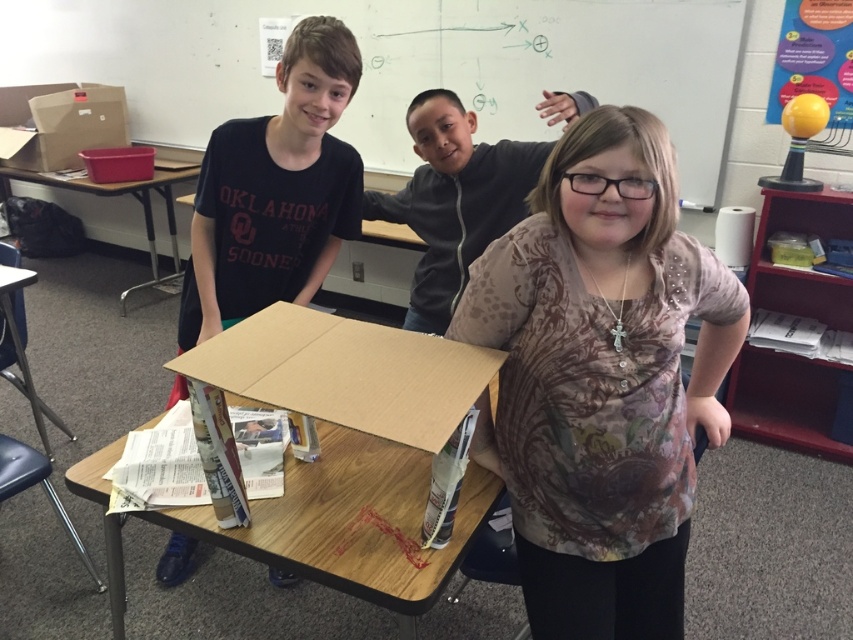
You are standing in the classroom and want to reach the point marked as point [456,564]. If your arm can extend 1 meter, can you reach it without moving closer?

The point [456,564] is 1.18 meters away from the viewer. Since your arm can only extend 1 meter, you cannot reach it without moving closer.